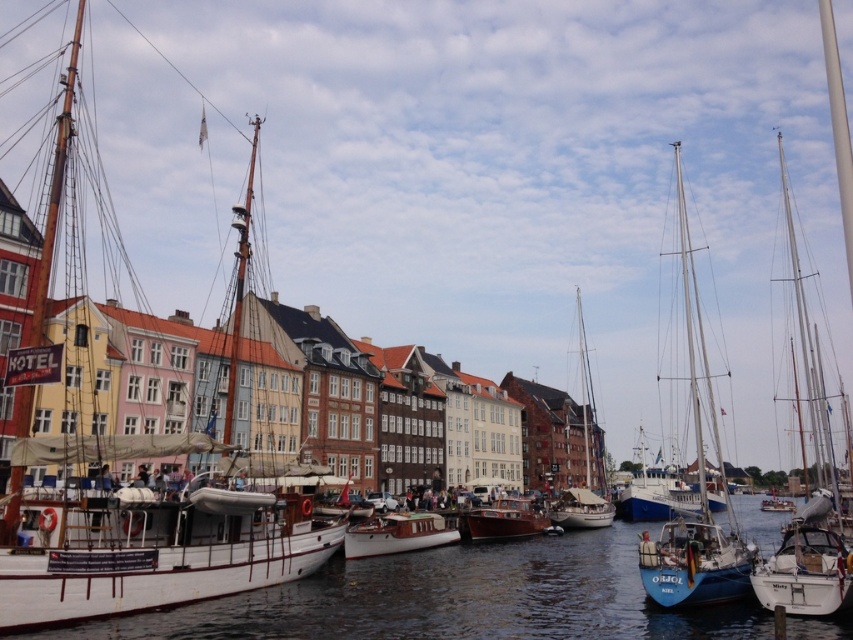
Is point (428, 515) closer to camera compared to point (761, 509)?

Yes.

How far apart are white polished wood boat at center and wooden sailboat at center?

A distance of 130.72 meters exists between white polished wood boat at center and wooden sailboat at center.

Does point (405, 536) come behind point (778, 509)?

No, it is in front of (778, 509).

This screenshot has width=853, height=640. Identify the location of white polished wood boat at center. (398, 534).

Which is above, white wooden sailboat at left or white glossy boat at lower right?

Positioned higher is white wooden sailboat at left.

Is white wooden sailboat at left positioned behind white glossy boat at lower right?

No, white wooden sailboat at left is in front of white glossy boat at lower right.

Where is `white wooden sailboat at left`? white wooden sailboat at left is located at coordinates (144, 536).

Can you confirm if white matte sailboat at right is shorter than white matte sailboat at center?

Incorrect, white matte sailboat at right's height does not fall short of white matte sailboat at center's.

Can you confirm if white matte sailboat at right is thinner than white matte sailboat at center?

No.

Where is `white matte sailboat at right`? white matte sailboat at right is located at coordinates point(807,481).